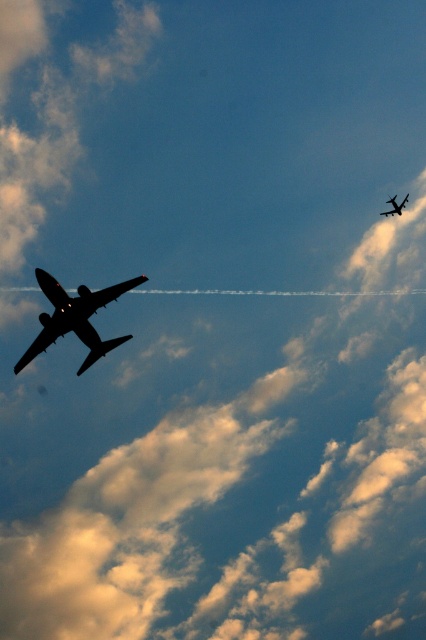
Looking at this image, does silhouette metallic airplane at left have a greater height compared to silhouette metallic airplane at upper center?

Yes.

From the picture: Which of these two, silhouette metallic airplane at left or silhouette metallic airplane at upper center, stands taller?

Standing taller between the two is silhouette metallic airplane at left.

Is point (42, 321) in front of point (402, 198)?

Yes, point (42, 321) is closer to viewer.

Find the location of a particular element. The image size is (426, 640). silhouette metallic airplane at left is located at coordinates (74, 317).